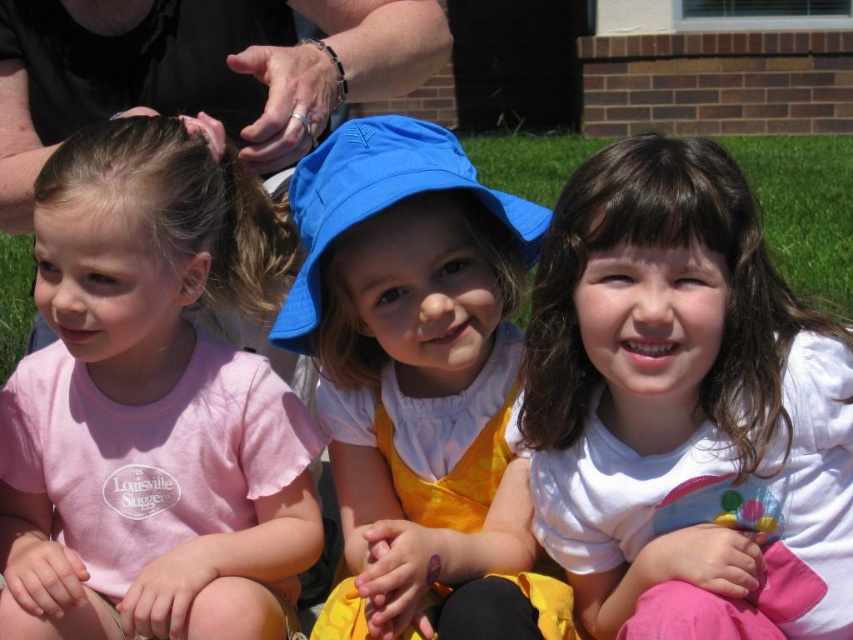
You are a photographer trying to capture a candid shot of the children. You notice two hats at the center of the image. Which hat is closer to the camera, the matte blue sunhat at center or the blue fabric hat at center?

The matte blue sunhat at center is positioned under the blue fabric hat at center, so the blue fabric hat at center is closer to the camera.

You are a photographer trying to capture a group photo of the three children. You want to ensure that both the pink cotton shirt at left and the blue fabric hat at center are clearly visible in the frame. Based on their positions, which child should you focus on to include both objects in the photo?

The photographer should focus on the middle child, as the pink cotton shirt at left is positioned on the left side of the blue fabric hat at center, meaning both objects are near the middle child and can be captured in the frame together.

You are a photographer setting up for a group photo of the children. You want to ensure that both the pink cotton shirt at left and the blue fabric hat at center are fully visible in the shot. Based on their positions, which child should be moved slightly forward to achieve this?

The child wearing the blue fabric hat at center should be moved forward since it is currently positioned behind the pink cotton shirt at left, making it partially obscured. Moving them forward would ensure both items are fully visible.